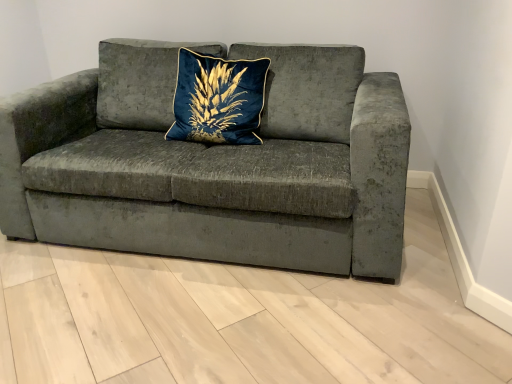
Question: Is velvet gray couch at center to the right of blue velvet pillow at center from the viewer's perspective?

Choices:
 (A) yes
 (B) no

Answer: (B)

Question: Considering the relative sizes of velvet gray couch at center and blue velvet pillow at center in the image provided, is velvet gray couch at center smaller than blue velvet pillow at center?

Choices:
 (A) no
 (B) yes

Answer: (A)

Question: From a real-world perspective, is velvet gray couch at center located beneath blue velvet pillow at center?

Choices:
 (A) no
 (B) yes

Answer: (B)

Question: Is velvet gray couch at center further to the viewer compared to blue velvet pillow at center?

Choices:
 (A) yes
 (B) no

Answer: (B)

Question: Can you confirm if velvet gray couch at center is bigger than blue velvet pillow at center?

Choices:
 (A) no
 (B) yes

Answer: (B)

Question: Can we say velvet gray couch at center lies outside blue velvet pillow at center?

Choices:
 (A) no
 (B) yes

Answer: (B)

Question: Is blue velvet pillow at center outside of velvet gray couch at center?

Choices:
 (A) no
 (B) yes

Answer: (A)

Question: Is blue velvet pillow at center aimed at velvet gray couch at center?

Choices:
 (A) no
 (B) yes

Answer: (B)

Question: Considering the relative sizes of blue velvet pillow at center and velvet gray couch at center in the image provided, is blue velvet pillow at center wider than velvet gray couch at center?

Choices:
 (A) no
 (B) yes

Answer: (A)

Question: Considering the relative sizes of blue velvet pillow at center and velvet gray couch at center in the image provided, is blue velvet pillow at center bigger than velvet gray couch at center?

Choices:
 (A) yes
 (B) no

Answer: (B)

Question: Does blue velvet pillow at center have a lesser height compared to velvet gray couch at center?

Choices:
 (A) no
 (B) yes

Answer: (B)

Question: From the image's perspective, is blue velvet pillow at center on top of velvet gray couch at center?

Choices:
 (A) no
 (B) yes

Answer: (B)

Question: Looking at their shapes, would you say blue velvet pillow at center is wider or thinner than velvet gray couch at center?

Choices:
 (A) thin
 (B) wide

Answer: (A)